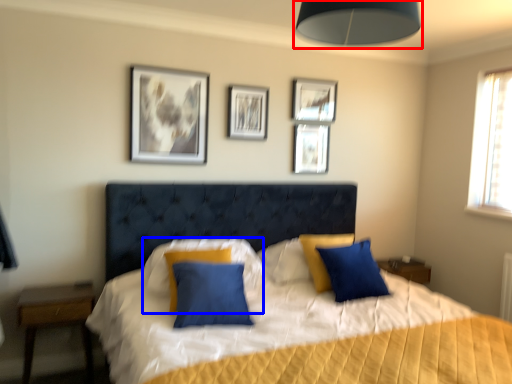
Question: Which object appears closest to the camera in this image, lamp (highlighted by a red box) or pillow (highlighted by a blue box)?

Choices:
 (A) lamp
 (B) pillow

Answer: (A)